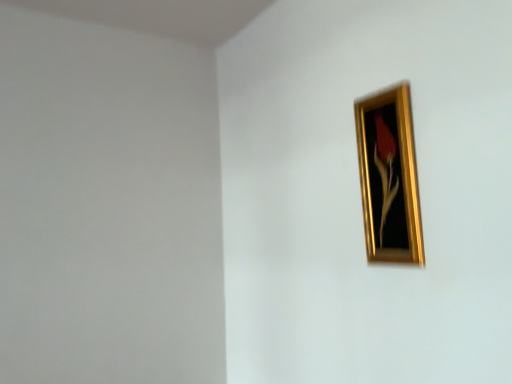
Measure the distance between point (x=375, y=145) and camera.

Point (x=375, y=145) and camera are 3.73 feet apart.

Locate an element on the screen. Image resolution: width=512 pixels, height=384 pixels. gold metallic picture frame at upper right is located at coordinates (389, 178).

What do you see at coordinates (389, 178) in the screenshot? The width and height of the screenshot is (512, 384). I see `gold metallic picture frame at upper right` at bounding box center [389, 178].

This screenshot has width=512, height=384. In order to click on gold metallic picture frame at upper right in this screenshot , I will do `click(389, 178)`.